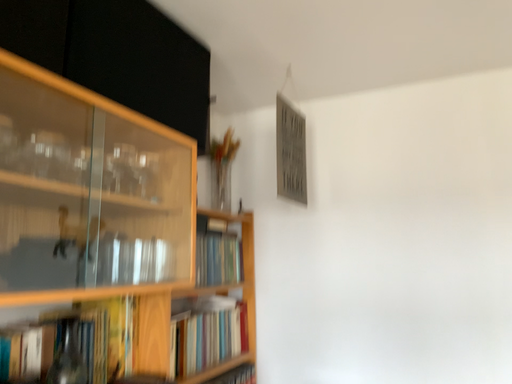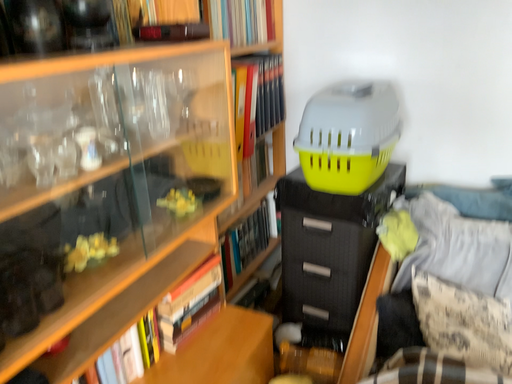
Question: How did the camera likely rotate when shooting the video?

Choices:
 (A) rotated downward
 (B) rotated upward

Answer: (A)